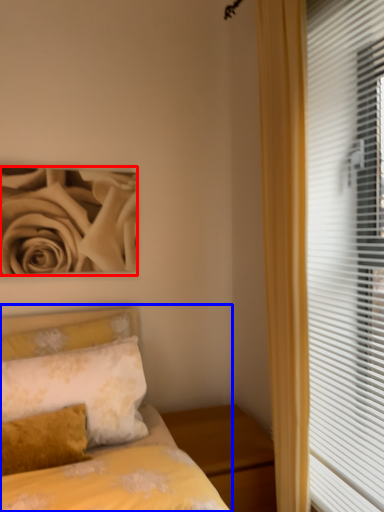
Question: Which object is further to the camera taking this photo, rose (highlighted by a red box) or bed (highlighted by a blue box)?

Choices:
 (A) rose
 (B) bed

Answer: (A)